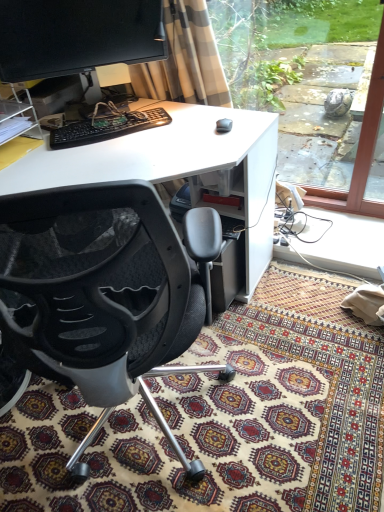
The image size is (384, 512). I want to click on white plastic desk at center, so click(174, 165).

What do you see at coordinates (312, 90) in the screenshot? The height and width of the screenshot is (512, 384). I see `transparent glass window at right` at bounding box center [312, 90].

Where is `white plastic desk at center`? Image resolution: width=384 pixels, height=512 pixels. white plastic desk at center is located at coordinates tap(174, 165).

Measure the distance between black plastic keyboard at center and patterned carpet at lower center.

black plastic keyboard at center and patterned carpet at lower center are 3.41 feet apart from each other.

Which object is thinner, black plastic keyboard at center or patterned carpet at lower center?

black plastic keyboard at center.

Is patterned carpet at lower center inside black plastic keyboard at center?

No, patterned carpet at lower center is not a part of black plastic keyboard at center.

From the image's perspective, is black plastic keyboard at center on top of patterned carpet at lower center?

Correct, black plastic keyboard at center appears higher than patterned carpet at lower center in the image.

Does matte black monitor at upper left appear on the left side of white plastic desk at center?

Yes, matte black monitor at upper left is to the left of white plastic desk at center.

Which object is closer to the camera taking this photo, matte black monitor at upper left or white plastic desk at center?

white plastic desk at center is in front.

Is point (61, 73) closer or farther from the camera than point (252, 182)?

Point (61, 73) is positioned farther from the camera compared to point (252, 182).

Considering the sizes of objects matte black monitor at upper left and white plastic desk at center in the image provided, who is smaller, matte black monitor at upper left or white plastic desk at center?

Smaller between the two is matte black monitor at upper left.

Does matte black monitor at upper left turn towards satin beige curtain at upper center?

No, matte black monitor at upper left is not aimed at satin beige curtain at upper center.

Find the location of `computer monitor on the left side of satin beige curtain at upper center`. computer monitor on the left side of satin beige curtain at upper center is located at coordinates (76, 36).

Which of these two, matte black monitor at upper left or satin beige curtain at upper center, stands taller?

satin beige curtain at upper center is taller.

Would you consider matte black monitor at upper left to be distant from satin beige curtain at upper center?

No, there isn't a large distance between matte black monitor at upper left and satin beige curtain at upper center.

Is transparent glass window at right beside white plastic desk at center?

transparent glass window at right is not next to white plastic desk at center, and they're not touching.

Is transparent glass window at right taller than white plastic desk at center?

Yes.

Is transparent glass window at right in front of or behind white plastic desk at center in the image?

Clearly, transparent glass window at right is behind white plastic desk at center.

Which object is thinner, transparent glass window at right or white plastic desk at center?

Thinner between the two is transparent glass window at right.

From the image's perspective, would you say black mesh chair at center is shown under transparent glass window at right?

Yes, from the image's perspective, black mesh chair at center is below transparent glass window at right.

Image resolution: width=384 pixels, height=512 pixels. Find the location of `chair directly beneath the transparent glass window at right (from a real-world perspective)`. chair directly beneath the transparent glass window at right (from a real-world perspective) is located at coordinates (101, 296).

From a real-world perspective, relative to transparent glass window at right, is black mesh chair at center vertically above or below?

From a real-world perspective, black mesh chair at center is physically below transparent glass window at right.

How different are the orientations of black mesh chair at center and black plastic keyboard at center in degrees?

There is a 165-degree angle between the facing directions of black mesh chair at center and black plastic keyboard at center.

Who is shorter, black mesh chair at center or black plastic keyboard at center?

With less height is black plastic keyboard at center.

Are black mesh chair at center and black plastic keyboard at center located far from each other?

Actually, black mesh chair at center and black plastic keyboard at center are a little close together.

From the image's perspective, does black mesh chair at center appear lower than black plastic keyboard at center?

Correct, black mesh chair at center appears lower than black plastic keyboard at center in the image.

From the image's perspective, is satin beige curtain at upper center below matte black monitor at upper left?

Yes.

Find the location of a particular element. computer monitor on the left side of satin beige curtain at upper center is located at coordinates (76, 36).

In terms of width, does satin beige curtain at upper center look wider or thinner when compared to matte black monitor at upper left?

satin beige curtain at upper center is wider than matte black monitor at upper left.

Would you say satin beige curtain at upper center is a long distance from matte black monitor at upper left?

No.

Identify the location of computer keyboard lying above the patterned carpet at lower center (from the image's perspective). The height and width of the screenshot is (512, 384). (107, 127).

You are a GUI agent. You are given a task and a screenshot of the screen. Output one action in this format:
    pyautogui.click(x=<x>, y=<y>)
    Task: Click on the computer monitor behind the white plastic desk at center
    Image resolution: width=384 pixels, height=512 pixels.
    Given the screenshot: What is the action you would take?
    pyautogui.click(x=76, y=36)

Estimate the real-world distances between objects in this image. Which object is further from matte black monitor at upper left, black plastic keyboard at center or white plastic desk at center?

white plastic desk at center lies further to matte black monitor at upper left than the other object.

When comparing their distances from satin beige curtain at upper center, does patterned carpet at lower center or black plastic keyboard at center seem closer?

black plastic keyboard at center lies closer to satin beige curtain at upper center than the other object.

Looking at the image, which one is located further to black mesh chair at center, white plastic desk at center or satin beige curtain at upper center?

The object further to black mesh chair at center is satin beige curtain at upper center.

Based on their spatial positions, is satin beige curtain at upper center or transparent glass window at right closer to white plastic desk at center?

satin beige curtain at upper center.

Considering their positions, is patterned carpet at lower center positioned closer to black plastic keyboard at center than black mesh chair at center?

Among the two, black mesh chair at center is located nearer to black plastic keyboard at center.

Estimate the real-world distances between objects in this image. Which object is further from white plastic desk at center, black mesh chair at center or satin beige curtain at upper center?

The object further to white plastic desk at center is black mesh chair at center.

Looking at the image, which one is located further to black plastic keyboard at center, white plastic desk at center or transparent glass window at right?

transparent glass window at right lies further to black plastic keyboard at center than the other object.

Estimate the real-world distances between objects in this image. Which object is further from matte black monitor at upper left, black mesh chair at center or transparent glass window at right?

Among the two, transparent glass window at right is located further to matte black monitor at upper left.

Locate an element on the screen. desk between matte black monitor at upper left and transparent glass window at right from left to right is located at coordinates (174, 165).

Locate an element on the screen. The width and height of the screenshot is (384, 512). curtain between black plastic keyboard at center and transparent glass window at right in the horizontal direction is located at coordinates point(185,60).

Find the location of `computer keyboard between matte black monitor at upper left and transparent glass window at right from left to right`. computer keyboard between matte black monitor at upper left and transparent glass window at right from left to right is located at coordinates (107, 127).

You are a GUI agent. You are given a task and a screenshot of the screen. Output one action in this format:
    pyautogui.click(x=<x>, y=<y>)
    Task: Click on the chair between white plastic desk at center and patterned carpet at lower center in the up-down direction
    This screenshot has height=512, width=384.
    Given the screenshot: What is the action you would take?
    pos(101,296)